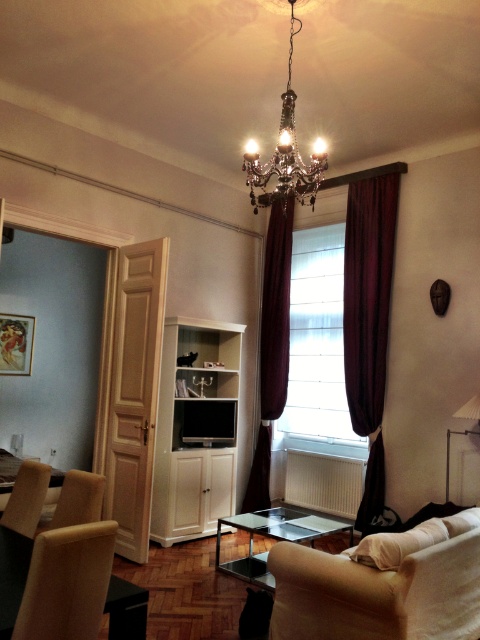
You are sitting on the matte brown chair at lower left and want to open the velvet dark red curtain at right. Can you reach it without moving from your seat?

The velvet dark red curtain at right is above the matte brown chair at lower left, so you can reach it by stretching upwards from your seated position.

You are a guest entering the living room and want to place a decorative vase on the table. Can you safely place it directly under the crystal glass chandelier at upper center without it being too close to the transparent glass table at center?

The crystal glass chandelier at upper center is located above the transparent glass table at center, so placing the vase directly under the chandelier would mean placing it on the table itself. Since the table is transparent, the vase can be safely placed there as it is directly under the chandelier and on the table.